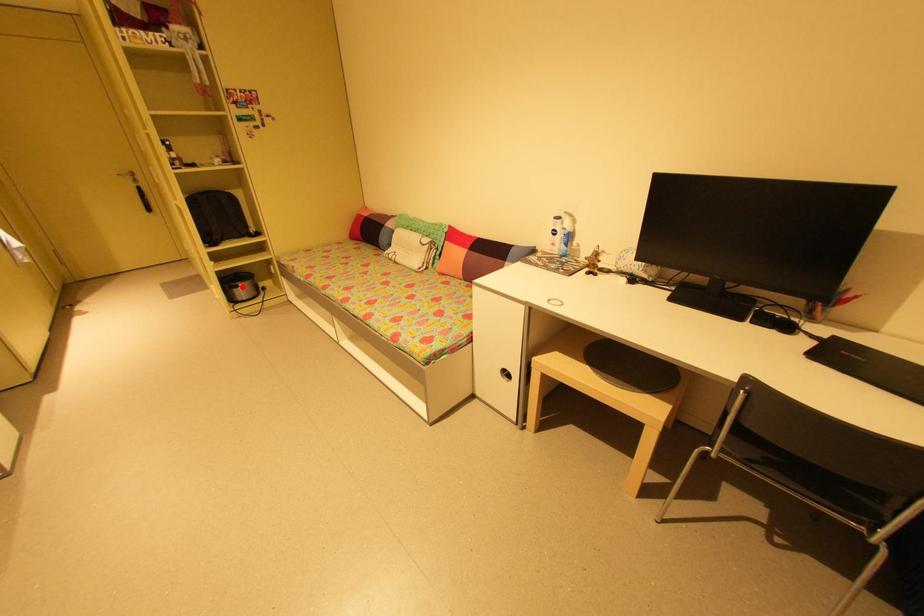
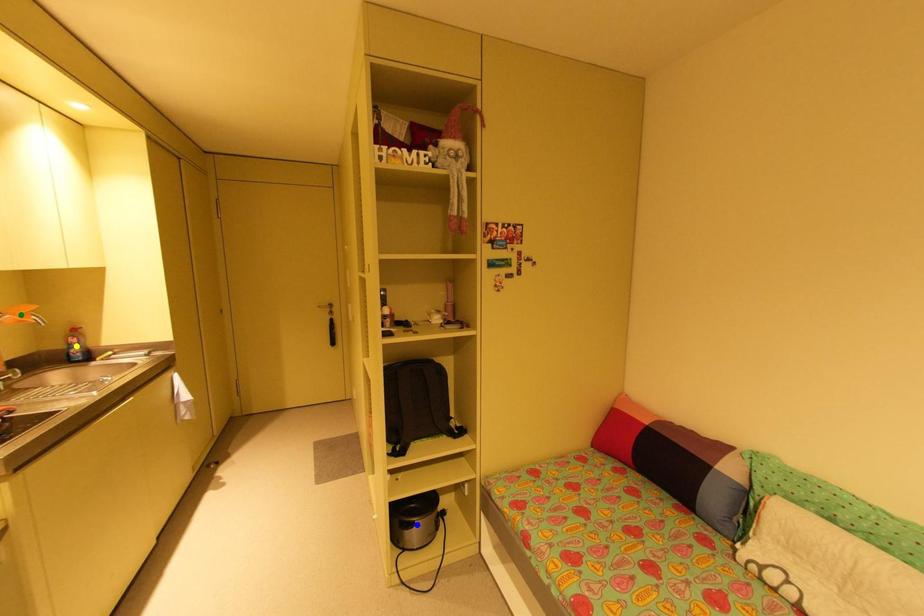
Question: I am providing you with two images of the same scene from different viewpoints. A red point is marked on the first image. You are given multiple points on the second image. Which spot in image 2 lines up with the point in image 1?

Choices:
 (A) blue point
 (B) green point
 (C) yellow point

Answer: (A)